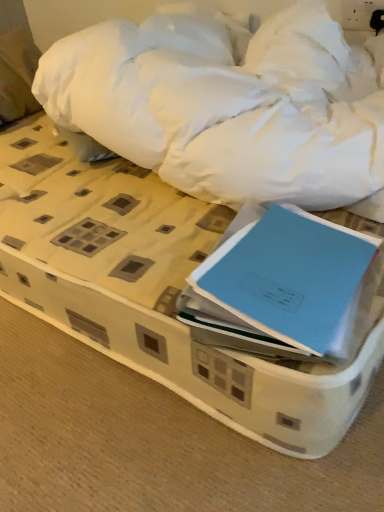
Image resolution: width=384 pixels, height=512 pixels. What do you see at coordinates (292, 280) in the screenshot?
I see `blue matte notebook at center` at bounding box center [292, 280].

Image resolution: width=384 pixels, height=512 pixels. Identify the location of blue matte notebook at center. (292, 280).

Find the location of `blue matte notebook at center`. blue matte notebook at center is located at coordinates (292, 280).